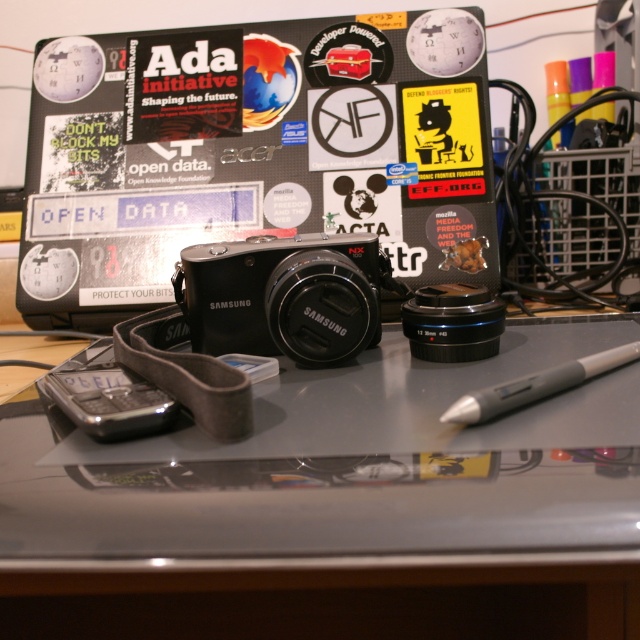
Between metallic gray mousepad at center and gray matte pen at lower right, which one is positioned higher?

gray matte pen at lower right

Who is taller, metallic gray mousepad at center or gray matte pen at lower right?

Standing taller between the two is metallic gray mousepad at center.

The image size is (640, 640). What are the coordinates of `metallic gray mousepad at center` in the screenshot? It's located at (317, 544).